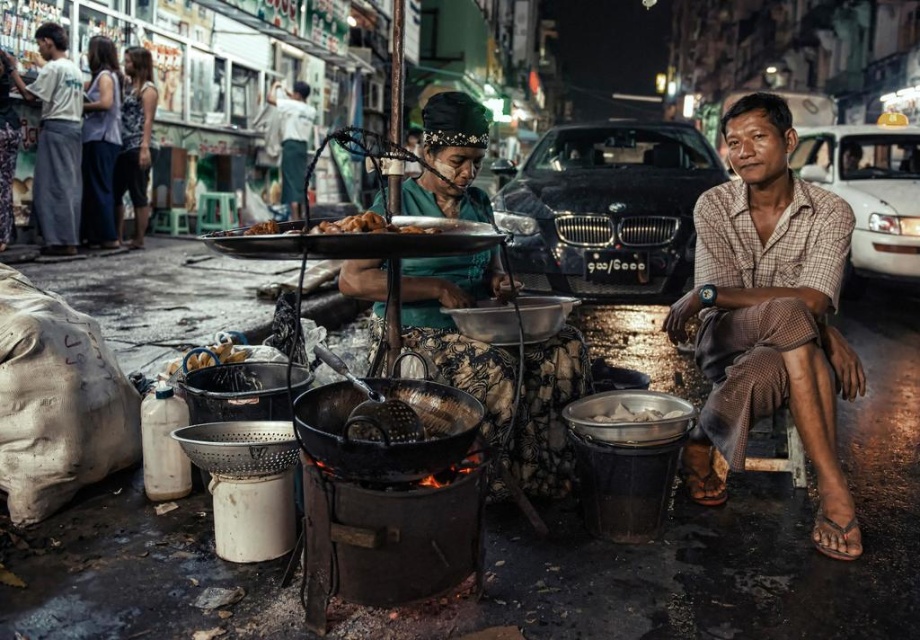
Between black metallic car at center and white glossy van at upper right, which one has more height?

With more height is white glossy van at upper right.

Does black metallic car at center have a greater height compared to white glossy van at upper right?

No, black metallic car at center is not taller than white glossy van at upper right.

The image size is (920, 640). Describe the element at coordinates (606, 209) in the screenshot. I see `black metallic car at center` at that location.

Find the location of a particular element. The width and height of the screenshot is (920, 640). black metallic car at center is located at coordinates (606, 209).

Can you confirm if brown checkered shirt at right is positioned to the right of white glossy van at upper right?

Incorrect, brown checkered shirt at right is not on the right side of white glossy van at upper right.

At what (x,y) coordinates should I click in order to perform the action: click on brown checkered shirt at right. Please return your answer as a coordinate pair (x, y). Looking at the image, I should click on (769, 314).

Is point (411, 317) positioned in front of point (608, 422)?

That is False.

Is point (535, 412) closer to viewer compared to point (654, 412)?

That is False.

This screenshot has width=920, height=640. What are the coordinates of `green fabric skirt at center` in the screenshot? It's located at (496, 365).